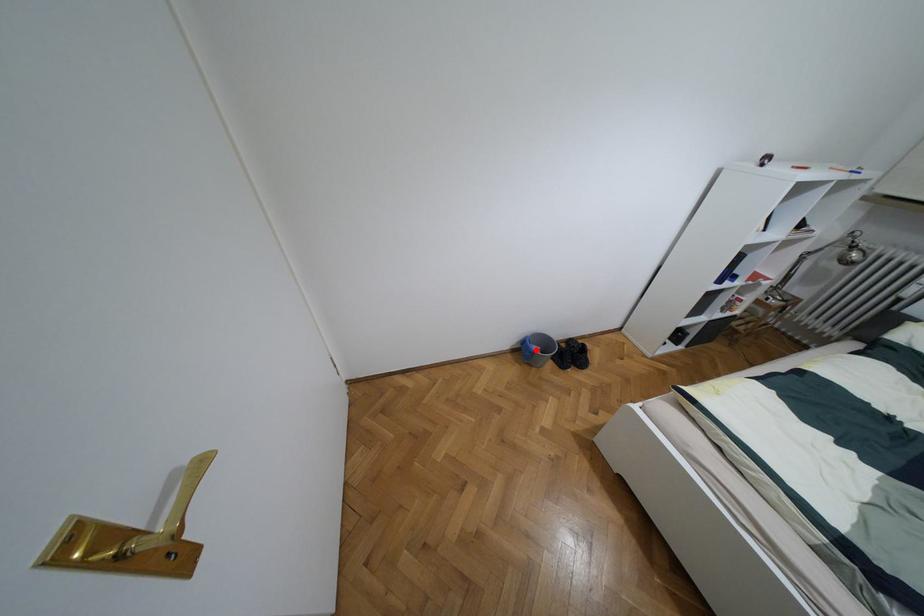
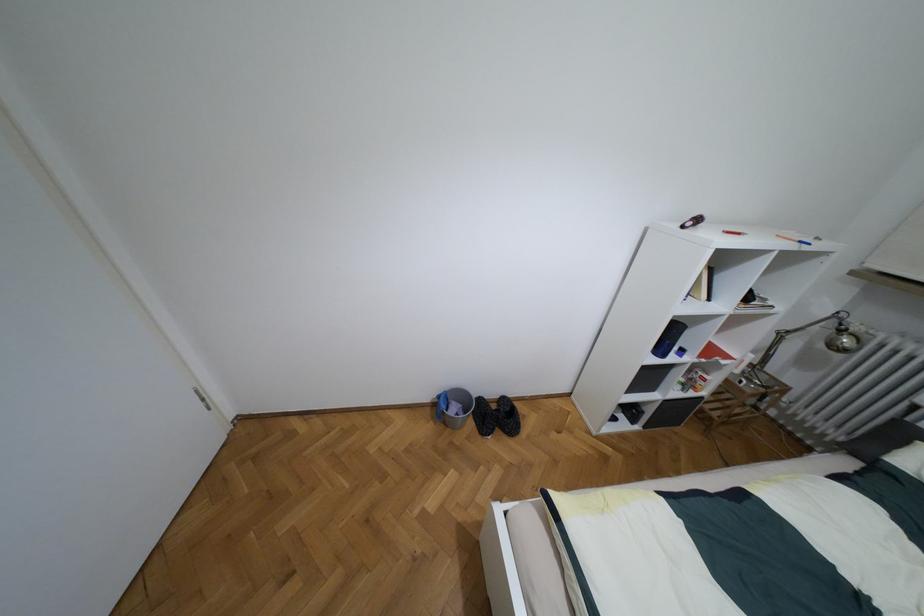
Question: A red point is marked in image1. In image2, is the corresponding 3D point closer to the camera or farther? Reply with the corresponding letter.

Choices:
 (A) The corresponding 3D point is closer.
 (B) The corresponding 3D point is farther.

Answer: (B)